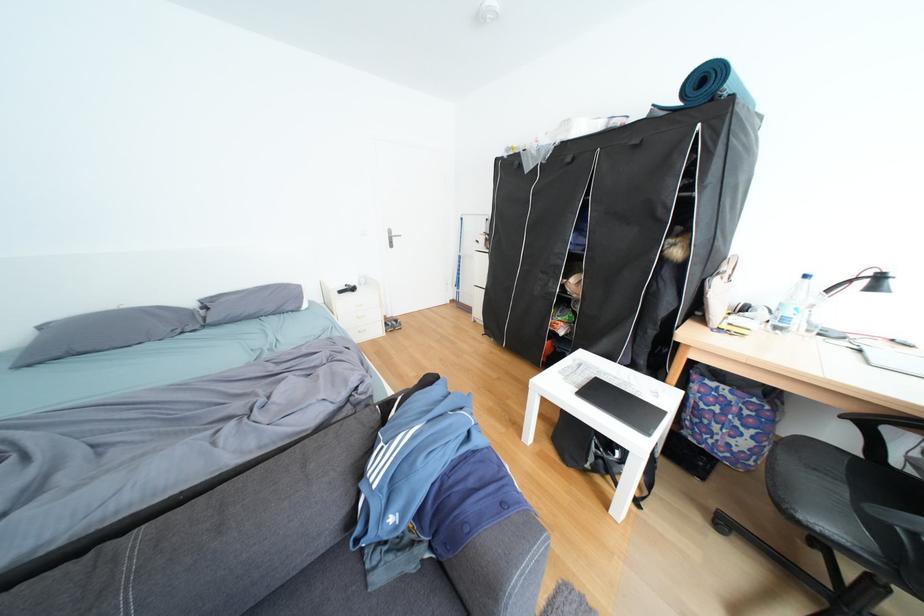
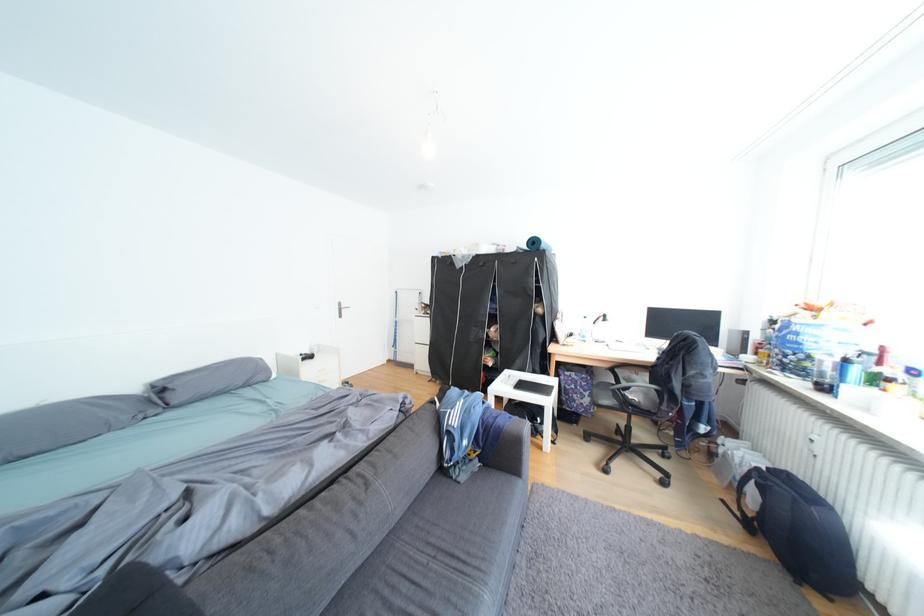
Where in the second image is the point corresponding to (x=406, y=520) from the first image?

(478, 444)